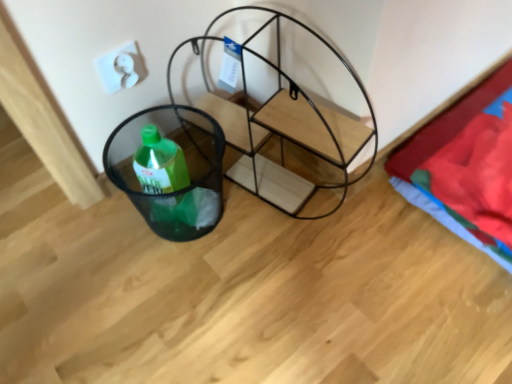
Question: From their relative heights in the image, would you say black mesh basket at lower left is taller or shorter than black wire shelving unit at center?

Choices:
 (A) short
 (B) tall

Answer: (A)

Question: From the image's perspective, is black mesh basket at lower left positioned above or below black wire shelving unit at center?

Choices:
 (A) above
 (B) below

Answer: (B)

Question: Which object is the closest to the white matte electric outlet at upper left?

Choices:
 (A) black mesh basket at lower left
 (B) black wire shelving unit at center
 (C) red cotton blanket at right

Answer: (A)

Question: Which object is positioned farthest from the white matte electric outlet at upper left?

Choices:
 (A) red cotton blanket at right
 (B) black mesh basket at lower left
 (C) black wire shelving unit at center

Answer: (A)